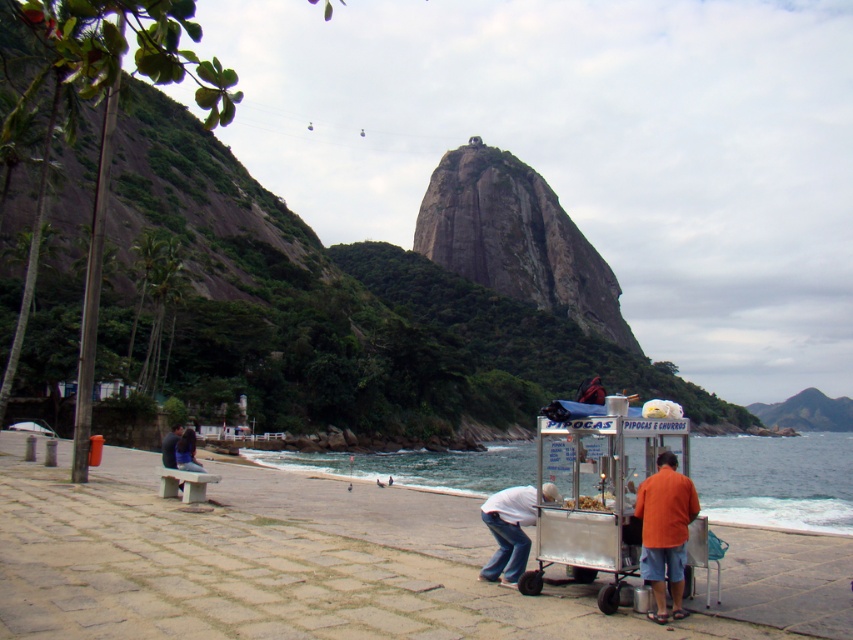
Is point (602, 432) positioned in front of point (675, 612)?

No.

Does metallic silver cart at lower center appear under orange cotton shirt at lower right?

Incorrect, metallic silver cart at lower center is not positioned below orange cotton shirt at lower right.

Describe the element at coordinates (614, 502) in the screenshot. I see `metallic silver cart at lower center` at that location.

At what (x,y) coordinates should I click in order to perform the action: click on metallic silver cart at lower center. Please return your answer as a coordinate pair (x, y). This screenshot has width=853, height=640. Looking at the image, I should click on (614, 502).

Is point (354, 609) positioned after point (532, 508)?

No, it is not.

Is smooth sand beach at lower center to the right of white cotton shirt at lower center from the viewer's perspective?

No, smooth sand beach at lower center is not to the right of white cotton shirt at lower center.

The width and height of the screenshot is (853, 640). In order to click on smooth sand beach at lower center in this screenshot , I will do `click(334, 563)`.

Based on the photo, can you confirm if smooth sand beach at lower center is wider than clear blue water at lower center?

No, smooth sand beach at lower center is not wider than clear blue water at lower center.

Which is more to the right, smooth sand beach at lower center or clear blue water at lower center?

clear blue water at lower center

Where is `smooth sand beach at lower center`? This screenshot has height=640, width=853. smooth sand beach at lower center is located at coordinates (334, 563).